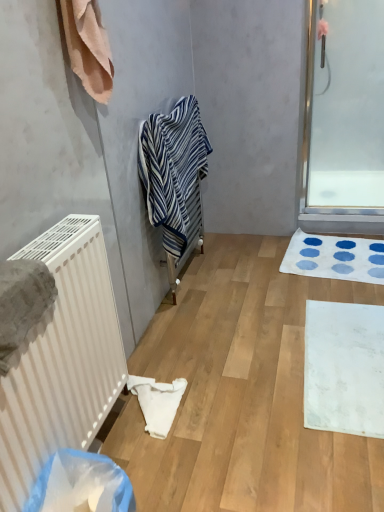
The width and height of the screenshot is (384, 512). Describe the element at coordinates (335, 257) in the screenshot. I see `white textured bath mat at lower right, placed as the second bath mat when sorted from bottom to top` at that location.

I want to click on white matte bath mat at lower right, the 2th bath mat from the top, so click(344, 368).

Where is `beige cotton towel at upper left, placed as the second towel when sorted from back to front`? beige cotton towel at upper left, placed as the second towel when sorted from back to front is located at coordinates (88, 47).

Measure the distance between point (23, 249) and camera.

Point (23, 249) and camera are 1.04 meters apart from each other.

The width and height of the screenshot is (384, 512). Find the location of `white textured bath mat at lower right, which is the second bath mat from front to back`. white textured bath mat at lower right, which is the second bath mat from front to back is located at coordinates (335, 257).

Is beige cotton towel at upper left, placed as the second towel when sorted from back to front, far from blue striped towel at center, the 3th towel positioned from the front?

beige cotton towel at upper left, placed as the second towel when sorted from back to front, is near blue striped towel at center, the 3th towel positioned from the front, not far away.

Is beige cotton towel at upper left, which is counted as the second towel, starting from the left, taller than blue striped towel at center, acting as the first towel starting from the back?

Incorrect, the height of beige cotton towel at upper left, which is counted as the second towel, starting from the left, is not larger of that of blue striped towel at center, acting as the first towel starting from the back.

Is beige cotton towel at upper left, placed as the second towel when sorted from back to front, in front of or behind blue striped towel at center, marked as the 3th towel in a left-to-right arrangement, in the image?

Clearly, beige cotton towel at upper left, placed as the second towel when sorted from back to front, is in front of blue striped towel at center, marked as the 3th towel in a left-to-right arrangement.

Is beige cotton towel at upper left, marked as the second towel in a right-to-left arrangement, wider or thinner than blue striped towel at center, acting as the first towel starting from the back?

beige cotton towel at upper left, marked as the second towel in a right-to-left arrangement, is thinner than blue striped towel at center, acting as the first towel starting from the back.

You are a GUI agent. You are given a task and a screenshot of the screen. Output one action in this format:
    pyautogui.click(x=<x>, y=<y>)
    Task: Click on the 1st bath mat counting from the right side of the gray textured towel at left, the 3th towel viewed from the back
    
    Given the screenshot: What is the action you would take?
    pyautogui.click(x=344, y=368)

Which is farther from the camera, (x=54, y=291) or (x=322, y=426)?

Positioned behind is point (x=322, y=426).

From their relative heights in the image, would you say gray textured towel at left, the 3th towel positioned from the right, is taller or shorter than white matte bath mat at lower right, the first bath mat when ordered from bottom to top?

gray textured towel at left, the 3th towel positioned from the right, is taller than white matte bath mat at lower right, the first bath mat when ordered from bottom to top.

How many degrees apart are the facing directions of gray textured towel at left, the 3th towel positioned from the right, and white matte bath mat at lower right, arranged as the second bath mat when viewed from the back?

They differ by 177 degrees in their facing directions.

Could you tell me if white plastic radiator at left is facing white textured bath mat at lower right, the first bath mat from the back?

No.

Considering the sizes of objects white plastic radiator at left and white textured bath mat at lower right, placed as the second bath mat when sorted from bottom to top, in the image provided, who is taller, white plastic radiator at left or white textured bath mat at lower right, placed as the second bath mat when sorted from bottom to top,?

Standing taller between the two is white plastic radiator at left.

Is white plastic radiator at left wider or thinner than white textured bath mat at lower right, the 1th bath mat positioned from the top?

In the image, white plastic radiator at left appears to be more narrow than white textured bath mat at lower right, the 1th bath mat positioned from the top.

Which object is more forward, white plastic radiator at left or white textured bath mat at lower right, the first bath mat from the back?

white plastic radiator at left is in front.

From the image's perspective, would you say blue striped towel at center, marked as the 3th towel in a left-to-right arrangement, is shown under beige cotton towel at upper left, marked as the second towel in a right-to-left arrangement?

Yes.

Is blue striped towel at center, marked as the 3th towel in a left-to-right arrangement, to the left or to the right of beige cotton towel at upper left, marked as the second towel in a right-to-left arrangement, in the image?

In the image, blue striped towel at center, marked as the 3th towel in a left-to-right arrangement, appears on the right side of beige cotton towel at upper left, marked as the second towel in a right-to-left arrangement.

From a real-world perspective, who is located higher, blue striped towel at center, the 3th towel positioned from the front, or beige cotton towel at upper left, marked as the second towel in a right-to-left arrangement?

beige cotton towel at upper left, marked as the second towel in a right-to-left arrangement, from a real-world perspective.

Does blue striped towel at center, marked as the 3th towel in a left-to-right arrangement, turn towards beige cotton towel at upper left, placed as the second towel when sorted from back to front?

No, blue striped towel at center, marked as the 3th towel in a left-to-right arrangement, is not aimed at beige cotton towel at upper left, placed as the second towel when sorted from back to front.

Considering the positions of points (202, 278) and (150, 419), is point (202, 278) closer to camera compared to point (150, 419)?

No, it is behind (150, 419).

From a real-world perspective, is white matte radiator at left positioned above or below white fabric towel at lower center?

Clearly, from a real-world perspective, white matte radiator at left is below white fabric towel at lower center.

Considering the sizes of objects white matte radiator at left and white fabric towel at lower center in the image provided, who is smaller, white matte radiator at left or white fabric towel at lower center?

Smaller between the two is white fabric towel at lower center.

Between blue striped towel at center, the 3th towel positioned from the front, and white plastic radiator at left, which one has more height?

Standing taller between the two is white plastic radiator at left.

Which is more to the left, blue striped towel at center, marked as the 3th towel in a left-to-right arrangement, or white plastic radiator at left?

Positioned to the left is white plastic radiator at left.

Is point (151, 205) closer or farther from the camera than point (95, 327)?

Point (151, 205) appears to be farther away from the viewer than point (95, 327).

Does blue striped towel at center, acting as the first towel starting from the back, have a lesser width compared to white plastic radiator at left?

No, blue striped towel at center, acting as the first towel starting from the back, is not thinner than white plastic radiator at left.

Considering the sizes of objects white fabric towel at lower center and beige cotton towel at upper left, marked as the second towel in a right-to-left arrangement, in the image provided, who is smaller, white fabric towel at lower center or beige cotton towel at upper left, marked as the second towel in a right-to-left arrangement,?

white fabric towel at lower center.

Measure the distance from white fabric towel at lower center to beige cotton towel at upper left, placed as the second towel when sorted from back to front.

They are 1.07 meters apart.

I want to click on material below the beige cotton towel at upper left, placed as the second towel when sorted from back to front (from the image's perspective), so pyautogui.click(x=157, y=402).

Considering the sizes of white fabric towel at lower center and beige cotton towel at upper left, marked as the second towel in a right-to-left arrangement, in the image, is white fabric towel at lower center wider or thinner than beige cotton towel at upper left, marked as the second towel in a right-to-left arrangement,?

Considering their sizes, white fabric towel at lower center looks broader than beige cotton towel at upper left, marked as the second towel in a right-to-left arrangement.

Locate an element on the screen. The height and width of the screenshot is (512, 384). the 2nd towel above the blue striped towel at center, which ranks as the first towel in right-to-left order (from a real-world perspective) is located at coordinates (88, 47).

Where is `the 1st towel positioned above the white matte bath mat at lower right, arranged as the second bath mat when viewed from the back (from the image's perspective)`? This screenshot has height=512, width=384. the 1st towel positioned above the white matte bath mat at lower right, arranged as the second bath mat when viewed from the back (from the image's perspective) is located at coordinates (22, 302).

Consider the image. When comparing their distances from white fabric towel at lower center, does transparent glass screen door at upper right or white plastic radiator at left seem closer?

The object closer to white fabric towel at lower center is white plastic radiator at left.

Estimate the real-world distances between objects in this image. Which object is further from beige cotton towel at upper left, the 2th towel in the front-to-back sequence, white plastic radiator at left or white matte radiator at left?

Among the two, white matte radiator at left is located further to beige cotton towel at upper left, the 2th towel in the front-to-back sequence.

Based on their spatial positions, is white matte bath mat at lower right, which appears as the first bath mat when viewed from the front, or beige cotton towel at upper left, the 2th towel in the front-to-back sequence, closer to gray textured towel at left, the first towel viewed from the left?

The object closer to gray textured towel at left, the first towel viewed from the left, is beige cotton towel at upper left, the 2th towel in the front-to-back sequence.

Considering their positions, is white matte bath mat at lower right, the first bath mat when ordered from bottom to top, positioned closer to transparent glass screen door at upper right than blue striped towel at center, the 3th towel positioned from the front?

Among the two, blue striped towel at center, the 3th towel positioned from the front, is located nearer to transparent glass screen door at upper right.

When comparing their distances from white plastic radiator at left, does blue striped towel at center, marked as the 3th towel in a left-to-right arrangement, or gray textured towel at left, the 3th towel positioned from the right, seem closer?

The object closer to white plastic radiator at left is gray textured towel at left, the 3th towel positioned from the right.

Looking at this image, which object lies further to the anchor point blue striped towel at center, which ranks as the first towel in right-to-left order, white matte bath mat at lower right, the first bath mat when ordered from bottom to top, or white fabric towel at lower center?

white matte bath mat at lower right, the first bath mat when ordered from bottom to top, lies further to blue striped towel at center, which ranks as the first towel in right-to-left order, than the other object.

Estimate the real-world distances between objects in this image. Which object is further from white plastic radiator at left, beige cotton towel at upper left, which is counted as the second towel, starting from the left, or gray textured towel at left, the 3th towel viewed from the back?

Among the two, beige cotton towel at upper left, which is counted as the second towel, starting from the left, is located further to white plastic radiator at left.

From the image, which object appears to be farther from white matte radiator at left, transparent glass screen door at upper right or beige cotton towel at upper left, which is counted as the second towel, starting from the left?

Among the two, beige cotton towel at upper left, which is counted as the second towel, starting from the left, is located further to white matte radiator at left.

This screenshot has width=384, height=512. I want to click on bath mat between white plastic radiator at left and white textured bath mat at lower right, the 1th bath mat positioned from the top, along the z-axis, so click(344, 368).

Locate an element on the screen. The width and height of the screenshot is (384, 512). towel between gray textured towel at left, the 3th towel viewed from the back, and blue striped towel at center, the 3th towel positioned from the front, in the front-back direction is located at coordinates (88, 47).

The image size is (384, 512). Identify the location of material located between white plastic radiator at left and transparent glass screen door at upper right in the depth direction. (157, 402).

At what (x,y) coordinates should I click in order to perform the action: click on concrete between transparent glass screen door at upper right and white matte bath mat at lower right, which appears as the first bath mat when viewed from the front, vertically. Please return your answer as a coordinate pair (x, y). The height and width of the screenshot is (512, 384). Looking at the image, I should click on (242, 394).